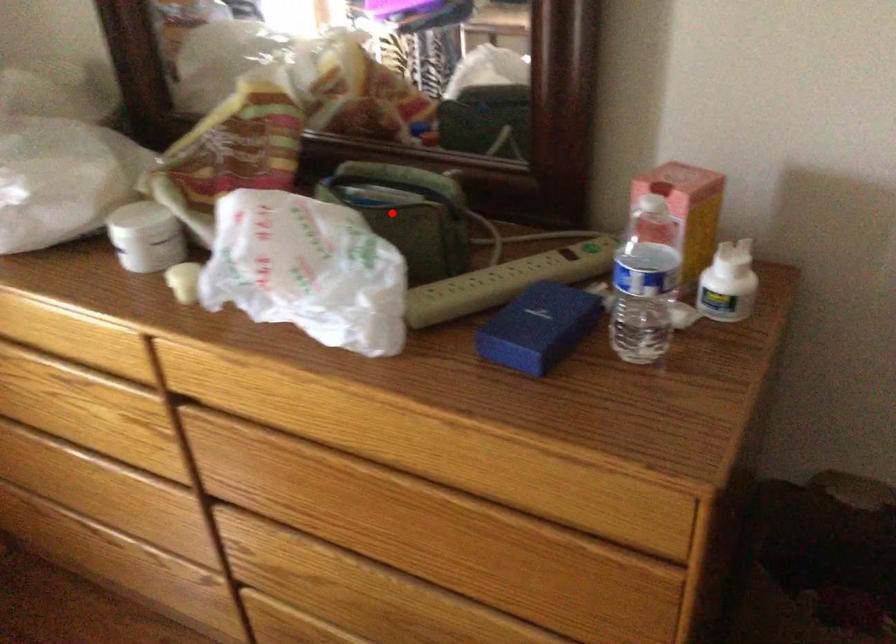
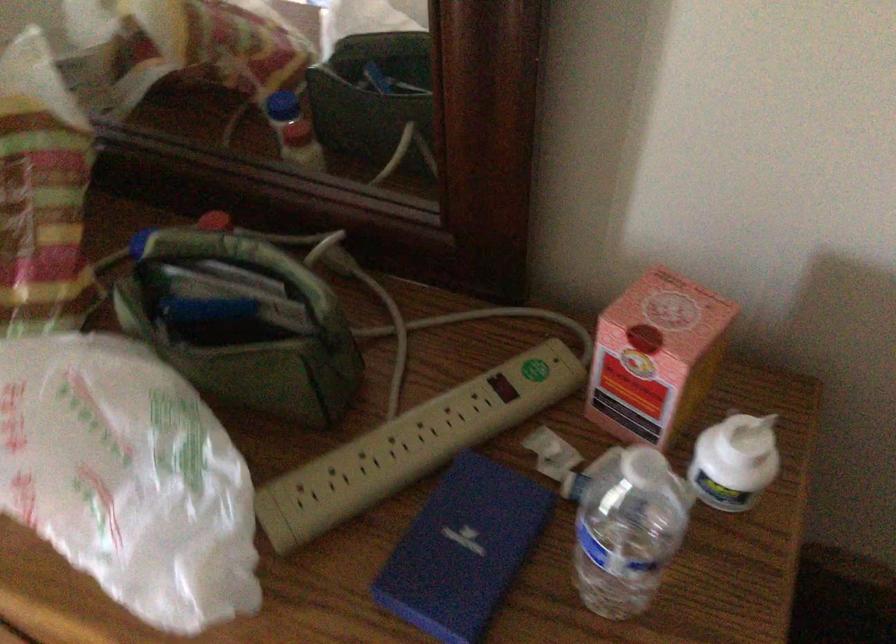
The point at the highlighted location is marked in the first image. Where is the corresponding point in the second image?

(239, 322)